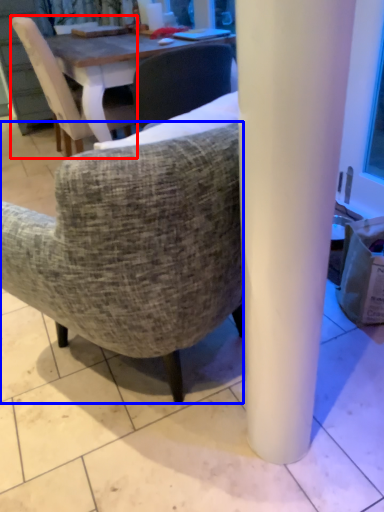
Question: Among these objects, which one is nearest to the camera, chair (highlighted by a red box) or chair (highlighted by a blue box)?

Choices:
 (A) chair
 (B) chair

Answer: (B)